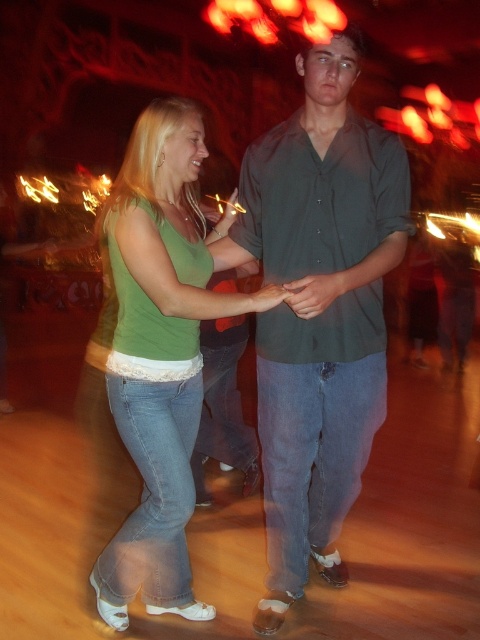
Question: Which point is farther to the camera?

Choices:
 (A) (295, 458)
 (B) (136, 244)

Answer: (A)

Question: Is dark green shirt at center bigger than green denim jeans at center?

Choices:
 (A) yes
 (B) no

Answer: (B)

Question: Is dark green shirt at center to the right of green denim jeans at center from the viewer's perspective?

Choices:
 (A) yes
 (B) no

Answer: (A)

Question: Does dark green shirt at center lie in front of green denim jeans at center?

Choices:
 (A) no
 (B) yes

Answer: (B)

Question: Which of the following is the farthest from the observer?

Choices:
 (A) dark green shirt at center
 (B) green denim jeans at center

Answer: (B)